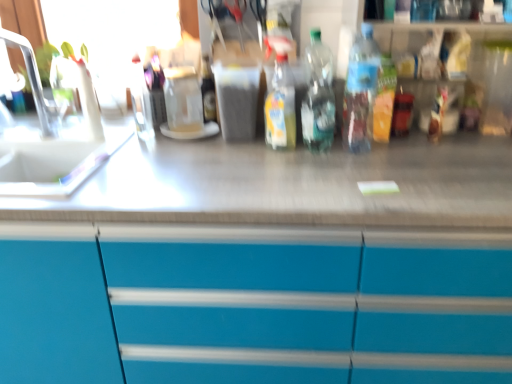
Question: Is transparent plastic bottle at center, which ranks as the second bottle in right-to-left order, taller or shorter than white plastic faucet at left?

Choices:
 (A) short
 (B) tall

Answer: (A)

Question: Is transparent plastic bottle at center, positioned as the third bottle in left-to-right order, wider or thinner than white plastic faucet at left?

Choices:
 (A) wide
 (B) thin

Answer: (B)

Question: Estimate the real-world distances between objects in this image. Which object is closer to the transparent glass jar at center?

Choices:
 (A) translucent plastic bottle at center, which is the 2th bottle from left to right
 (B) transparent plastic bottle at center, which ranks as the second bottle in right-to-left order
 (C) blue glossy cabinet at lower center
 (D) white plastic faucet at left
 (E) clear plastic bottle at upper center, marked as the 1th bottle in a left-to-right arrangement

Answer: (E)

Question: Estimate the real-world distances between objects in this image. Which object is farther from the translucent plastic bottle at center, the 3th bottle positioned from the right?

Choices:
 (A) translucent plastic bottle at center, which ranks as the fourth bottle in left-to-right order
 (B) white plastic faucet at left
 (C) blue glossy cabinet at lower center
 (D) clear plastic bottle at upper center, marked as the 1th bottle in a left-to-right arrangement
 (E) transparent plastic bottle at center, which ranks as the second bottle in right-to-left order

Answer: (B)